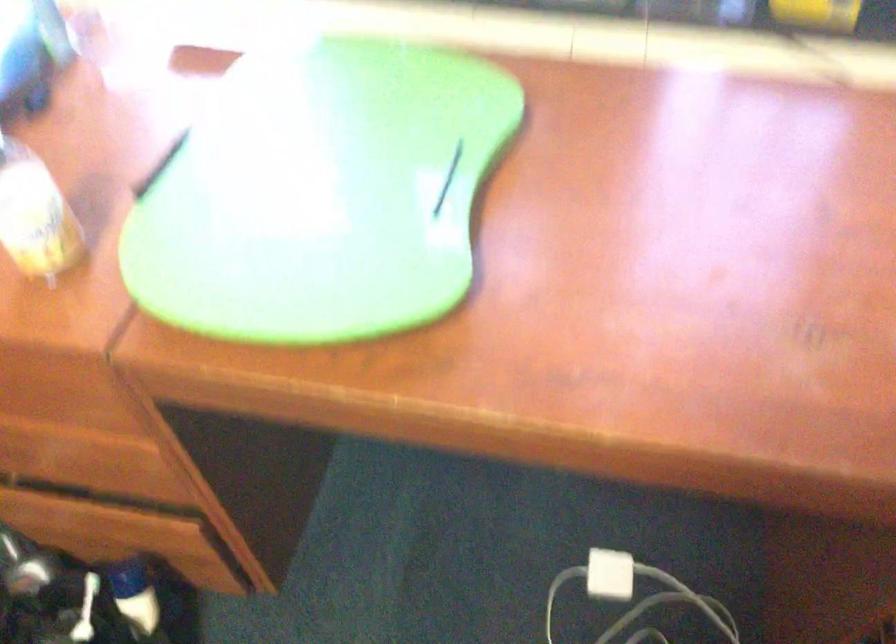
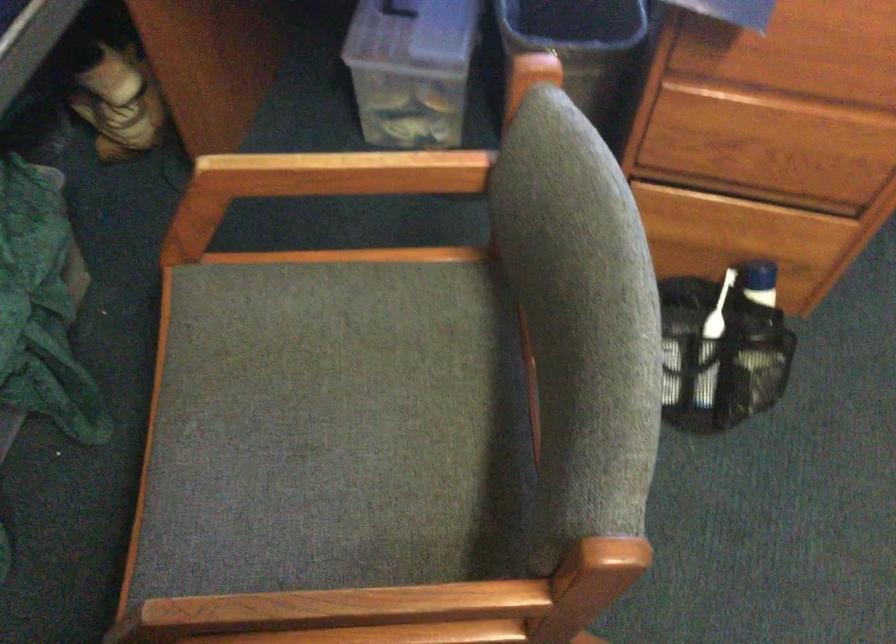
Question: Which direction would the cameraman need to move to produce the second image? Reply with the corresponding letter.

Choices:
 (A) Left
 (B) Right
 (C) Forward
 (D) Backward

Answer: (A)